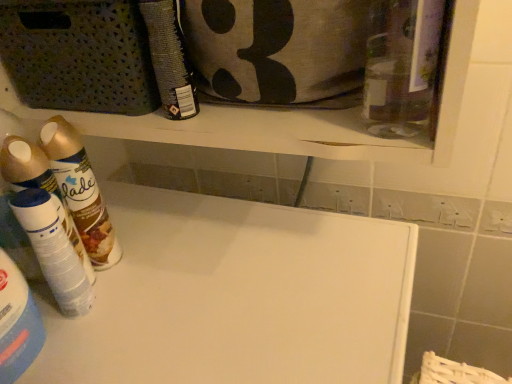
Question: Is textured gray fabric pouch at upper center closer to the viewer compared to gold metallic spray can at left, the first cleaning product in the left-to-right sequence?

Choices:
 (A) no
 (B) yes

Answer: (B)

Question: From the image's perspective, does textured gray fabric pouch at upper center appear higher than gold metallic spray can at left, the third cleaning product positioned from the right?

Choices:
 (A) no
 (B) yes

Answer: (B)

Question: Does textured gray fabric pouch at upper center appear on the right side of gold metallic spray can at left, the first cleaning product in the left-to-right sequence?

Choices:
 (A) no
 (B) yes

Answer: (B)

Question: Could you tell me if textured gray fabric pouch at upper center is facing gold metallic spray can at left, the first cleaning product in the left-to-right sequence?

Choices:
 (A) yes
 (B) no

Answer: (B)

Question: Can you confirm if textured gray fabric pouch at upper center is wider than gold metallic spray can at left, the third cleaning product positioned from the right?

Choices:
 (A) no
 (B) yes

Answer: (B)

Question: Is point (141, 195) positioned closer to the camera than point (342, 0)?

Choices:
 (A) farther
 (B) closer

Answer: (A)

Question: From the image's perspective, relative to textured gray fabric pouch at upper center, is white matte board at center above or below?

Choices:
 (A) below
 (B) above

Answer: (A)

Question: Based on their sizes in the image, would you say white matte board at center is bigger or smaller than textured gray fabric pouch at upper center?

Choices:
 (A) big
 (B) small

Answer: (A)

Question: In the image, is white matte board at center on the left side or the right side of textured gray fabric pouch at upper center?

Choices:
 (A) right
 (B) left

Answer: (B)

Question: Is matte black spray can at upper center, acting as the 3th cleaning product starting from the left, wider or thinner than textured gray fabric pouch at upper center?

Choices:
 (A) thin
 (B) wide

Answer: (A)

Question: From a real-world perspective, is matte black spray can at upper center, acting as the 3th cleaning product starting from the left, positioned above or below textured gray fabric pouch at upper center?

Choices:
 (A) above
 (B) below

Answer: (A)

Question: Is point (168, 46) positioned closer to the camera than point (268, 44)?

Choices:
 (A) closer
 (B) farther

Answer: (B)

Question: From the image's perspective, relative to textured gray fabric pouch at upper center, is matte black spray can at upper center, acting as the 3th cleaning product starting from the left, above or below?

Choices:
 (A) below
 (B) above

Answer: (A)

Question: From a real-world perspective, is white plastic spray can at left, positioned as the second cleaning product in right-to-left order, physically located above or below white matte board at center?

Choices:
 (A) below
 (B) above

Answer: (B)

Question: Considering the positions of white plastic spray can at left, positioned as the second cleaning product in right-to-left order, and white matte board at center in the image, is white plastic spray can at left, positioned as the second cleaning product in right-to-left order, wider or thinner than white matte board at center?

Choices:
 (A) thin
 (B) wide

Answer: (A)